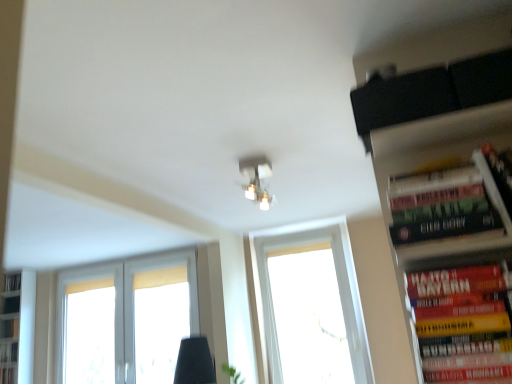
The height and width of the screenshot is (384, 512). Identify the location of white matte window at lower left, arranged as the 1th window when viewed from the left. tap(115, 306).

Where is `matte white light fixture at center`? The width and height of the screenshot is (512, 384). matte white light fixture at center is located at coordinates (256, 179).

At what (x,y) coordinates should I click in order to perform the action: click on hardcover book at lower left, which is the first book from bottom to top. Please return your answer as a coordinate pair (x, y). The image size is (512, 384). Looking at the image, I should click on (8, 352).

Image resolution: width=512 pixels, height=384 pixels. Describe the element at coordinates (310, 308) in the screenshot. I see `transparent glass window at center, the first window when ordered from right to left` at that location.

The height and width of the screenshot is (384, 512). Identify the location of white matte window at lower left, arranged as the 1th window when viewed from the left. (115, 306).

Could you tell me if transparent glass window at center, the first window when ordered from right to left, is facing white matte bookshelf at left?

No.

From a real-world perspective, which is physically below, transparent glass window at center, the first window when ordered from right to left, or white matte bookshelf at left?

From a 3D spatial view, transparent glass window at center, the first window when ordered from right to left, is below.

Would you say transparent glass window at center, the first window when ordered from right to left, is to the left or to the right of white matte bookshelf at left in the picture?

Based on their positions, transparent glass window at center, the first window when ordered from right to left, is located to the right of white matte bookshelf at left.

From the image's perspective, is transparent glass window at center, the second window in the left-to-right sequence, located above or below white matte bookshelf at left?

From the image's perspective, transparent glass window at center, the second window in the left-to-right sequence, appears above white matte bookshelf at left.

Are hardcover book at right, positioned as the 2th book in left-to-right order, and hardcover book at lower left, the third book viewed from the front, far apart?

That's right, there is a large distance between hardcover book at right, positioned as the 2th book in left-to-right order, and hardcover book at lower left, the third book viewed from the front.

Does hardcover book at right, arranged as the 1th book when viewed from the top, have a smaller size compared to hardcover book at lower left, which is the first book from bottom to top?

No, hardcover book at right, arranged as the 1th book when viewed from the top, is not smaller than hardcover book at lower left, which is the first book from bottom to top.

Is point (488, 210) closer to viewer compared to point (2, 350)?

That is True.

In terms of height, does hardcover book at right, arranged as the second book when viewed from the back, look taller or shorter compared to hardcover book at lower left, arranged as the first book when viewed from the left?

In the image, hardcover book at right, arranged as the second book when viewed from the back, appears to be taller than hardcover book at lower left, arranged as the first book when viewed from the left.

Is hardcover book at lower left, which is the first book from bottom to top, facing towards hardcover book at right, which is the second book in bottom-to-top order?

No, hardcover book at lower left, which is the first book from bottom to top, is not aimed at hardcover book at right, which is the second book in bottom-to-top order.

Is hardcover book at lower left, the 3th book from the top, wider than hardcover book at right, arranged as the first book when viewed from the front?

In fact, hardcover book at lower left, the 3th book from the top, might be narrower than hardcover book at right, arranged as the first book when viewed from the front.

From the image's perspective, between hardcover book at lower left, which is the first book from back to front, and hardcover book at right, the first book viewed from the right, who is located below?

hardcover book at lower left, which is the first book from back to front, appears lower in the image.

Which of these two, hardcover book at right, the 3th book when ordered from left to right, or matte white light fixture at center, is thinner?

Thinner between the two is hardcover book at right, the 3th book when ordered from left to right.

From the picture: Considering the relative sizes of hardcover book at right, which ranks as the second book in top-to-bottom order, and matte white light fixture at center in the image provided, is hardcover book at right, which ranks as the second book in top-to-bottom order, taller than matte white light fixture at center?

Yes.

Would you say matte white light fixture at center is part of hardcover book at right, arranged as the first book when viewed from the front,'s contents?

No, matte white light fixture at center is not a part of hardcover book at right, arranged as the first book when viewed from the front.

At what (x,y) coordinates should I click in order to perform the action: click on light fixture on the left of hardcover book at right, which ranks as the second book in top-to-bottom order. Please return your answer as a coordinate pair (x, y). Image resolution: width=512 pixels, height=384 pixels. Looking at the image, I should click on (256, 179).

Does hardcover book at lower left, the third book viewed from the front, have a lesser width compared to white matte window at lower left, positioned as the second window in right-to-left order?

Yes.

Could white matte window at lower left, arranged as the 1th window when viewed from the left, be considered to be inside hardcover book at lower left, which is the first book from bottom to top?

No, white matte window at lower left, arranged as the 1th window when viewed from the left, is not a part of hardcover book at lower left, which is the first book from bottom to top.

Can you tell me how much hardcover book at lower left, the third book viewed from the front, and white matte window at lower left, arranged as the 1th window when viewed from the left, differ in facing direction?

1.32 degrees.

In the scene shown: From the image's perspective, is white matte bookshelf at left located above white matte window at lower left, arranged as the 1th window when viewed from the left?

No, from the image's perspective, white matte bookshelf at left is not over white matte window at lower left, arranged as the 1th window when viewed from the left.

From the picture: Does white matte bookshelf at left appear on the left side of white matte window at lower left, positioned as the second window in right-to-left order?

Yes.

Is white matte bookshelf at left located outside white matte window at lower left, arranged as the 1th window when viewed from the left?

Absolutely, white matte bookshelf at left is external to white matte window at lower left, arranged as the 1th window when viewed from the left.

Identify the location of bookshelf above the white matte window at lower left, positioned as the second window in right-to-left order (from a real-world perspective). (17, 327).

Considering the relative positions of hardcover book at right, which is the third book in bottom-to-top order, and matte white light fixture at center in the image provided, is hardcover book at right, which is the third book in bottom-to-top order, in front of matte white light fixture at center?

Yes.

Considering the relative positions of hardcover book at right, arranged as the second book when viewed from the back, and matte white light fixture at center in the image provided, is hardcover book at right, arranged as the second book when viewed from the back, to the left of matte white light fixture at center from the viewer's perspective?

No.

Does point (511, 165) lie behind point (254, 196)?

No, (511, 165) is closer to viewer.

Is hardcover book at right, which is the third book in bottom-to-top order, oriented towards matte white light fixture at center?

No, hardcover book at right, which is the third book in bottom-to-top order, is not aimed at matte white light fixture at center.

This screenshot has width=512, height=384. Find the location of `the 2nd window in front of the white matte bookshelf at left, counting from the anchor's position`. the 2nd window in front of the white matte bookshelf at left, counting from the anchor's position is located at coordinates (x=310, y=308).

From a real-world perspective, which book is the 1st one underneath the hardcover book at right, the 2th book positioned from the right? Please provide its 2D coordinates.

[(8, 352)]

Considering their positions, is hardcover book at right, the 3th book when ordered from left to right, positioned closer to hardcover book at lower left, arranged as the 3th book when viewed from the right, than white matte bookshelf at left?

white matte bookshelf at left lies closer to hardcover book at lower left, arranged as the 3th book when viewed from the right, than the other object.

Considering their positions, is transparent glass window at center, the first window when ordered from right to left, positioned further to matte white light fixture at center than hardcover book at right, which is the third book in bottom-to-top order?

Based on the image, transparent glass window at center, the first window when ordered from right to left, appears to be further to matte white light fixture at center.

When comparing their distances from hardcover book at right, which is the third book in bottom-to-top order, does matte white light fixture at center or transparent glass window at center, the second window in the left-to-right sequence, seem closer?

Based on the image, matte white light fixture at center appears to be nearer to hardcover book at right, which is the third book in bottom-to-top order.

Which object lies nearer to the anchor point hardcover book at right, arranged as the second book when viewed from the back, hardcover book at right, which ranks as the third book in back-to-front order, or matte white light fixture at center?

hardcover book at right, which ranks as the third book in back-to-front order, lies closer to hardcover book at right, arranged as the second book when viewed from the back, than the other object.

From the image, which object appears to be nearer to white matte bookshelf at left, hardcover book at right, which is the second book in bottom-to-top order, or matte white light fixture at center?

Among the two, matte white light fixture at center is located nearer to white matte bookshelf at left.

In the scene shown: Considering their positions, is hardcover book at right, arranged as the second book when viewed from the back, positioned closer to transparent glass window at center, the first window when ordered from right to left, than matte white light fixture at center?

matte white light fixture at center.

Looking at the image, which one is located further to white matte window at lower left, positioned as the second window in right-to-left order, transparent glass window at center, the first window when ordered from right to left, or white matte bookshelf at left?

transparent glass window at center, the first window when ordered from right to left, lies further to white matte window at lower left, positioned as the second window in right-to-left order, than the other object.

Considering their positions, is matte white light fixture at center positioned closer to transparent glass window at center, the second window in the left-to-right sequence, than hardcover book at lower left, arranged as the first book when viewed from the left?

Among the two, matte white light fixture at center is located nearer to transparent glass window at center, the second window in the left-to-right sequence.

The height and width of the screenshot is (384, 512). I want to click on bookshelf positioned between hardcover book at right, which is the second book in bottom-to-top order, and hardcover book at lower left, arranged as the first book when viewed from the left, from near to far, so click(17, 327).

This screenshot has width=512, height=384. I want to click on book between white matte bookshelf at left and transparent glass window at center, the first window when ordered from right to left, in the horizontal direction, so tap(8, 352).

Where is `window between white matte bookshelf at left and transparent glass window at center, the second window in the left-to-right sequence, in the horizontal direction`? This screenshot has width=512, height=384. window between white matte bookshelf at left and transparent glass window at center, the second window in the left-to-right sequence, in the horizontal direction is located at coordinates (115, 306).

Find the location of a particular element. The image size is (512, 384). light fixture between white matte bookshelf at left and hardcover book at right, arranged as the first book when viewed from the front, in the horizontal direction is located at coordinates (256, 179).